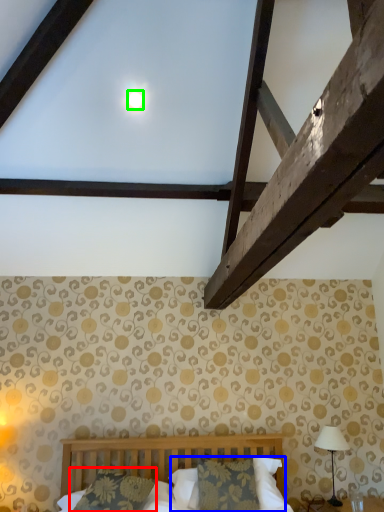
Question: Which object is the closest to the pillow (highlighted by a red box)? Choose among these: pillow (highlighted by a blue box) or moonlight (highlighted by a green box).

Choices:
 (A) pillow
 (B) moonlight

Answer: (A)